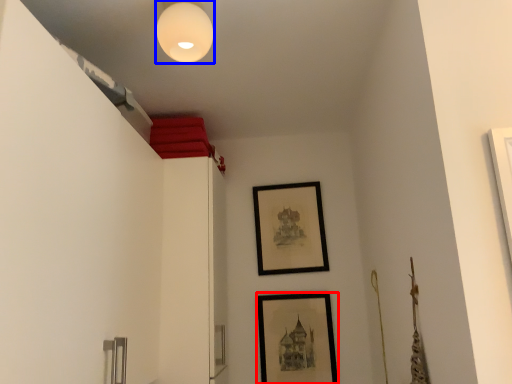
Question: Which object is closer to the camera taking this photo, picture frame (highlighted by a red box) or light fixture (highlighted by a blue box)?

Choices:
 (A) picture frame
 (B) light fixture

Answer: (B)